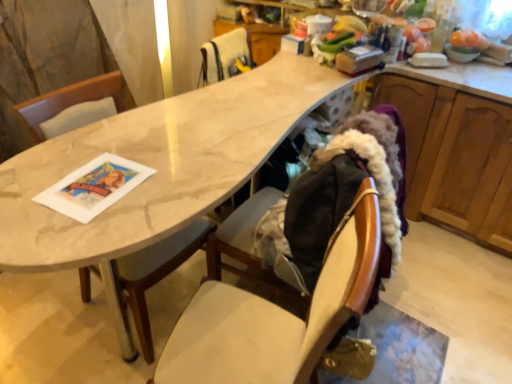
What is the approximate height of white fur at upper center, the 1th chair from the back?

It is 26.16 centimeters.

The image size is (512, 384). Find the location of `wooden cabinet at right`. wooden cabinet at right is located at coordinates (455, 159).

From the image's perspective, would you say white fur at upper center, the 1th chair from the back, is shown under wooden chair at center, which appears as the second chair when viewed from the top?

Incorrect, from the image's perspective, white fur at upper center, the 1th chair from the back, is higher than wooden chair at center, which appears as the second chair when viewed from the top.

Can we say white fur at upper center, positioned as the 2th chair in front-to-back order, lies outside wooden chair at center, arranged as the 2th chair when viewed from the back?

white fur at upper center, positioned as the 2th chair in front-to-back order, is positioned outside wooden chair at center, arranged as the 2th chair when viewed from the back.

Is white fur at upper center, which is counted as the 1th chair, starting from the top, wider or thinner than wooden chair at center, the 1th chair in the front-to-back sequence?

white fur at upper center, which is counted as the 1th chair, starting from the top, is thinner than wooden chair at center, the 1th chair in the front-to-back sequence.

Considering the relative sizes of wooden cabinet at right and white fur at upper center, acting as the 2th chair starting from the bottom, in the image provided, is wooden cabinet at right wider than white fur at upper center, acting as the 2th chair starting from the bottom,?

Yes.

Would you consider wooden cabinet at right to be distant from white fur at upper center, the 1th chair from the back?

Indeed, wooden cabinet at right is not near white fur at upper center, the 1th chair from the back.

Is wooden cabinet at right not within white fur at upper center, which is counted as the 1th chair, starting from the top?

Indeed, wooden cabinet at right is completely outside white fur at upper center, which is counted as the 1th chair, starting from the top.

From the image's perspective, is wooden chair at center, arranged as the 2th chair when viewed from the back, located beneath wooden cabinet at right?

Yes, from the image's perspective, wooden chair at center, arranged as the 2th chair when viewed from the back, is below wooden cabinet at right.

Is wooden chair at center, which appears as the second chair when viewed from the top, positioned behind wooden cabinet at right?

No, it is in front of wooden cabinet at right.

Between wooden chair at center, which appears as the second chair when viewed from the top, and wooden cabinet at right, which one has larger width?

With larger width is wooden cabinet at right.

Based on the photo, is wooden chair at center, the 1th chair in the front-to-back sequence, oriented away from wooden cabinet at right?

wooden chair at center, the 1th chair in the front-to-back sequence, does not have its back to wooden cabinet at right.

How distant is wooden cabinet at right from wooden chair at center, the 1th chair in the front-to-back sequence?

wooden cabinet at right and wooden chair at center, the 1th chair in the front-to-back sequence, are 4.17 feet apart from each other.

From the image's perspective, which one is positioned higher, wooden cabinet at right or wooden chair at center, arranged as the 2th chair when viewed from the back?

From the image's view, wooden cabinet at right is above.

Would you say wooden cabinet at right is to the left or to the right of wooden chair at center, the 1th chair in the front-to-back sequence, in the picture?

Based on their positions, wooden cabinet at right is located to the right of wooden chair at center, the 1th chair in the front-to-back sequence.

Can you confirm if wooden cabinet at right is thinner than wooden chair at center, arranged as the 2th chair when viewed from the back?

No.

Can you confirm if white fur at upper center, positioned as the 2th chair in front-to-back order, is positioned to the right of wooden cabinet at right?

No.

Is white fur at upper center, acting as the 2th chair starting from the bottom, taller than wooden cabinet at right?

In fact, white fur at upper center, acting as the 2th chair starting from the bottom, may be shorter than wooden cabinet at right.

Is white fur at upper center, positioned as the 2th chair in front-to-back order, beside wooden cabinet at right?

No, white fur at upper center, positioned as the 2th chair in front-to-back order, is not making contact with wooden cabinet at right.

Considering the relative positions of white fur at upper center, which is counted as the 1th chair, starting from the top, and wooden cabinet at right in the image provided, is white fur at upper center, which is counted as the 1th chair, starting from the top, in front of wooden cabinet at right?

No, it is behind wooden cabinet at right.

Considering the relative sizes of wooden chair at center, arranged as the 2th chair when viewed from the back, and white fur at upper center, acting as the 2th chair starting from the bottom, in the image provided, is wooden chair at center, arranged as the 2th chair when viewed from the back, smaller than white fur at upper center, acting as the 2th chair starting from the bottom,?

Incorrect, wooden chair at center, arranged as the 2th chair when viewed from the back, is not smaller in size than white fur at upper center, acting as the 2th chair starting from the bottom.

Can we say wooden chair at center, arranged as the 2th chair when viewed from the back, lies outside white fur at upper center, acting as the 2th chair starting from the bottom?

Indeed, wooden chair at center, arranged as the 2th chair when viewed from the back, is completely outside white fur at upper center, acting as the 2th chair starting from the bottom.

Is wooden chair at center, arranged as the first chair when ordered from the bottom, taller or shorter than white fur at upper center, the 1th chair from the back?

In the image, wooden chair at center, arranged as the first chair when ordered from the bottom, appears to be taller than white fur at upper center, the 1th chair from the back.

At what (x,y) coordinates should I click in order to perform the action: click on chair above the wooden chair at center, the 1th chair in the front-to-back sequence (from the image's perspective). Please return your answer as a coordinate pair (x, y). Looking at the image, I should click on (225, 57).

Find the location of `cabinetry below the white fur at upper center, positioned as the 2th chair in front-to-back order (from the image's perspective)`. cabinetry below the white fur at upper center, positioned as the 2th chair in front-to-back order (from the image's perspective) is located at coordinates (455, 159).

Based on their spatial positions, is wooden chair at center, arranged as the 2th chair when viewed from the back, or wooden cabinet at right closer to white fur at upper center, the 1th chair from the back?

Based on the image, wooden cabinet at right appears to be nearer to white fur at upper center, the 1th chair from the back.

Estimate the real-world distances between objects in this image. Which object is further from wooden cabinet at right, white fur at upper center, positioned as the 2th chair in front-to-back order, or wooden chair at center, the 1th chair in the front-to-back sequence?

wooden chair at center, the 1th chair in the front-to-back sequence, is further to wooden cabinet at right.

Which object lies nearer to the anchor point wooden chair at center, arranged as the first chair when ordered from the bottom, wooden cabinet at right or white fur at upper center, which is counted as the 1th chair, starting from the top?

white fur at upper center, which is counted as the 1th chair, starting from the top, is positioned closer to the anchor wooden chair at center, arranged as the first chair when ordered from the bottom.

From the image, which object appears to be farther from wooden chair at center, which appears as the second chair when viewed from the top, white fur at upper center, which is counted as the 1th chair, starting from the top, or wooden cabinet at right?

Based on the image, wooden cabinet at right appears to be further to wooden chair at center, which appears as the second chair when viewed from the top.

When comparing their distances from white fur at upper center, the 1th chair from the back, does wooden cabinet at right or wooden chair at center, arranged as the first chair when ordered from the bottom, seem closer?

Among the two, wooden cabinet at right is located nearer to white fur at upper center, the 1th chair from the back.

Based on their spatial positions, is wooden chair at center, arranged as the 2th chair when viewed from the back, or white fur at upper center, acting as the 2th chair starting from the bottom, closer to wooden cabinet at right?

white fur at upper center, acting as the 2th chair starting from the bottom.

Identify the location of chair between white fur at upper center, acting as the 2th chair starting from the bottom, and wooden cabinet at right, in the horizontal direction. (276, 315).